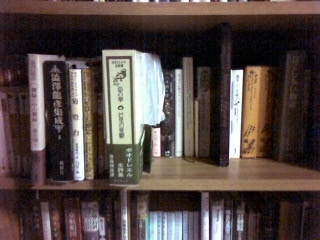
Image resolution: width=320 pixels, height=240 pixels. Identify the location of book cases. (7, 47), (250, 89).